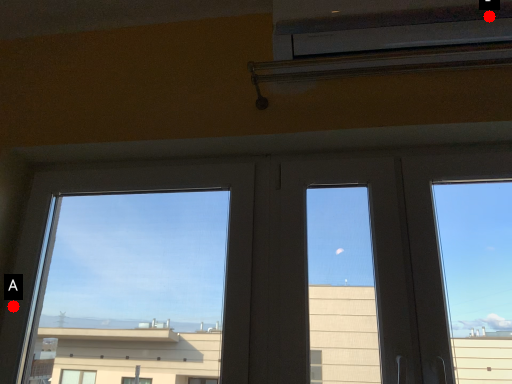
Question: Two points are circled on the image, labeled by A and B beside each circle. Among these points, which one is nearest to the camera?

Choices:
 (A) A is closer
 (B) B is closer

Answer: (B)